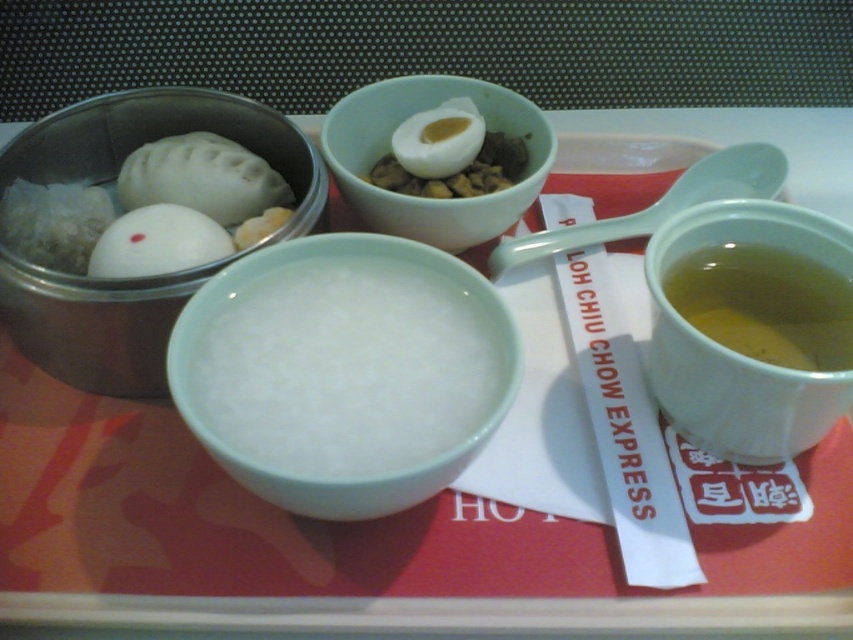
Looking at this image, you are a food delivery person who needs to place the white glossy rice porridge at center and the matte white egg at center into a delivery box. The box has a divider that can only hold items within 10 inches of each other. Will both items fit within the divider without overlapping?

The white glossy rice porridge at center is 11.43 inches away from the matte white egg at center. Since the divider can only hold items within 10 inches of each other, the distance between them exceeds the limit, so they cannot fit within the divider without overlapping.

You are standing 30 inches away from a red tray with a white napkin. There is a point labeled at coordinates point (709,272) on the tray. Can you reach that point without moving closer to the tray?

The distance of point (709,272) from viewer is 25.00 inches. Since you are standing 30 inches away, you are 5 inches farther than the point. Therefore, you can reach the point without moving closer.

You are a delivery person who needs to place a hot pot on the table. The table has a rectangular surface that is 24 inches long and 18 inches wide. There are two objects on the table already. The first object is at point A with coordinates point A at (431, 480) and the second object is at point B with coordinates point B at 0.328, 0.671. You need to place the hot pot such that it is centered between these two objects. What are the coordinates where you should place the hot pot?

The coordinates for placing the hot pot should be the midpoint between point A at (431, 480) and point B at 0.328, 0.671. To calculate the midpoint, average the x and y coordinates separately. The midpoint x is 0.750 and 0.328 divided by 2 equals 0.539, and the midpoint y is 0.506 and 0.671 divided by 2 equals 0.5885. Therefore, the hot pot should be placed at coordinates 0.539, 0.5885.